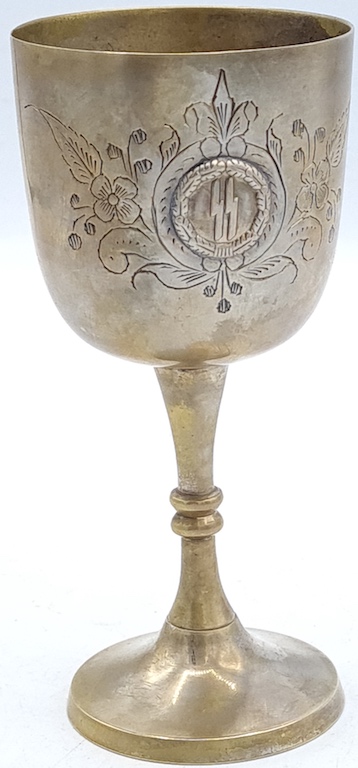
Find the location of a particular element. the bottom portion of the stem of the goblet is located at coordinates (199, 588).